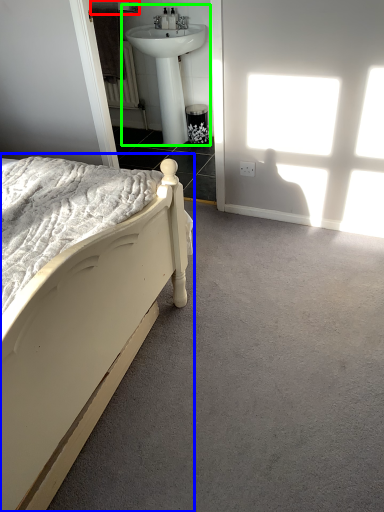
Question: Which is nearer to the towel bar (highlighted by a red box)? bed (highlighted by a blue box) or sink (highlighted by a green box).

Choices:
 (A) bed
 (B) sink

Answer: (B)